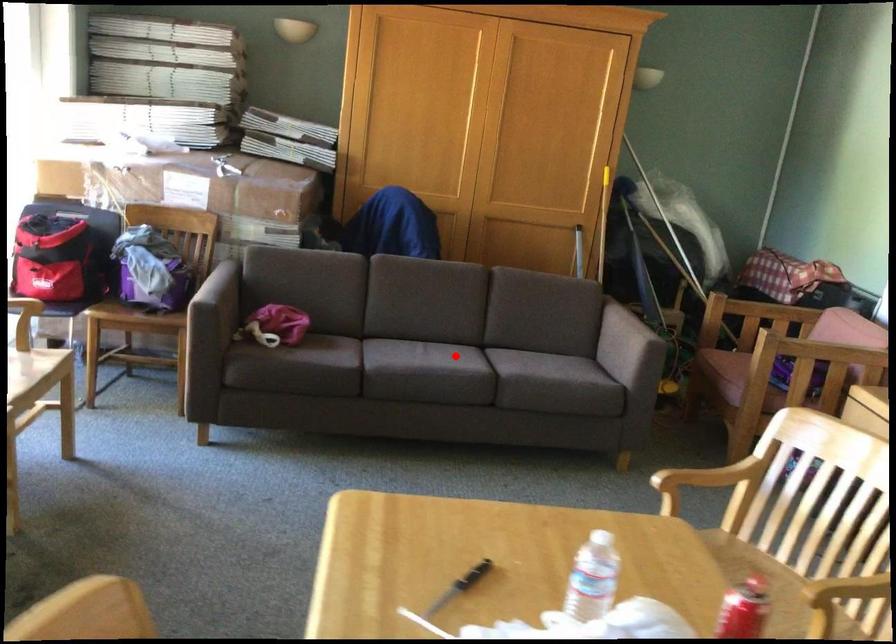
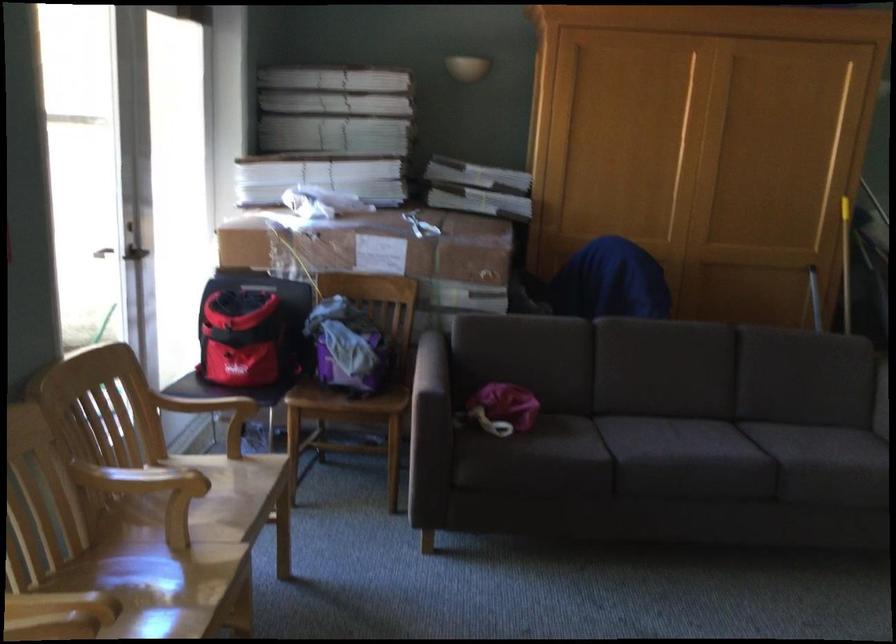
The point at the highlighted location is marked in the first image. Where is the corresponding point in the second image?

(724, 439)